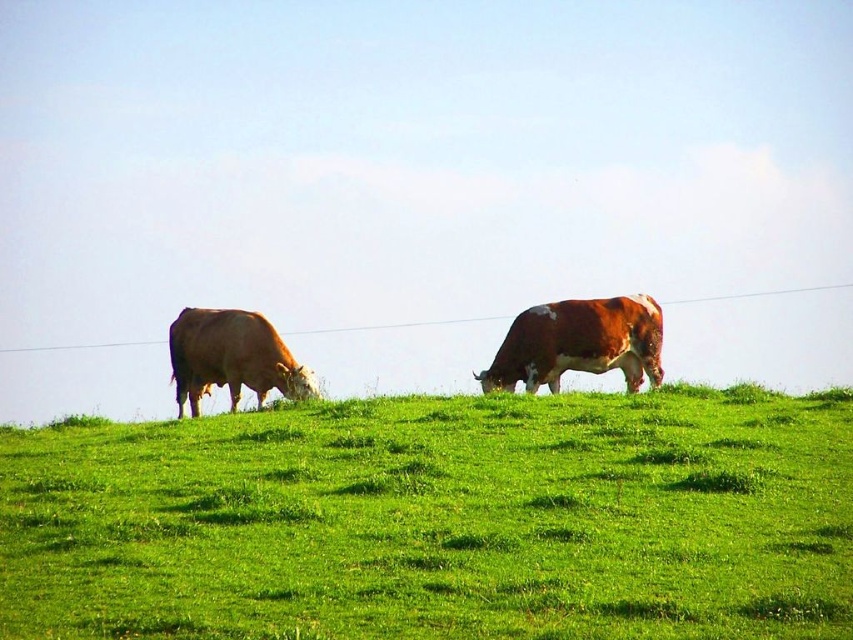
You are a farmer checking the pasture. You see the green grassy hillside at center and the brown smooth cow at left. Which area has more space for the cows to graze?

The green grassy hillside at center might be wider than brown smooth cow at left, so it likely has more space for grazing.

You are standing on the green grassy hillside at center and want to reach the brown speckled cow at center. Which direction should you move to get closer to the cow?

The green grassy hillside at center is located below the brown speckled cow at center, so you should move upward to reach the cow.

Consider the image. You are standing at the point marked by coordinates point (438, 518). Looking around, you see the green grassy hillside at center. Which direction should you walk to reach the lower part of the hill?

Since the hill slopes gently upwards from left to right, walking to the left would take you downhill towards the lower part of the hill.